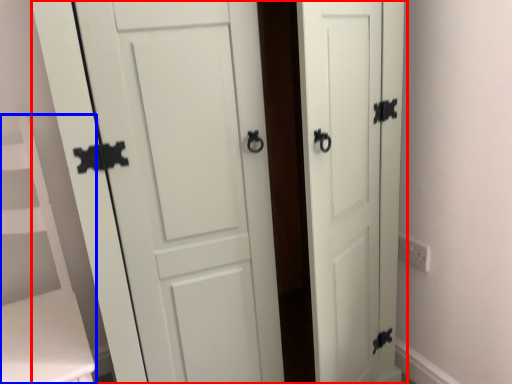
Question: Which of the following is the closest to the observer, door (highlighted by a red box) or vanity (highlighted by a blue box)?

Choices:
 (A) door
 (B) vanity

Answer: (A)